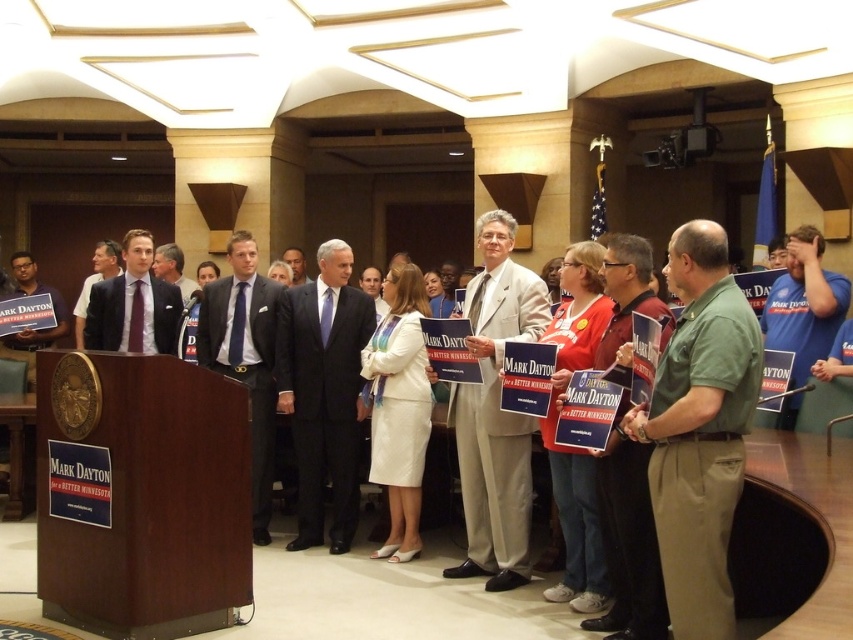
Is blue t-shirt at right below dark blue suit at center?

Correct, blue t-shirt at right is located below dark blue suit at center.

Based on the photo, which is below, blue t-shirt at right or dark blue suit at center?

blue t-shirt at right

Does point (837, 292) lie in front of point (288, 256)?

Yes, point (837, 292) is closer to viewer.

Find the location of a particular element. Image resolution: width=853 pixels, height=640 pixels. blue t-shirt at right is located at coordinates (804, 305).

Who is taller, matte black suit at center or light brown suit at center?

With more height is matte black suit at center.

Which is behind, point (364, 298) or point (164, 273)?

The point (164, 273) is behind.

Is point (294, 346) positioned after point (161, 259)?

No, (294, 346) is closer to viewer.

Find the location of a particular element. The height and width of the screenshot is (640, 853). matte black suit at center is located at coordinates (323, 392).

Consider the image. Is green fabric shirt at center taller than light beige suit at center?

Incorrect, green fabric shirt at center's height is not larger of light beige suit at center's.

Does point (733, 436) come closer to viewer compared to point (463, 416)?

Yes, point (733, 436) is closer to viewer.

Identify the location of green fabric shirt at center. (699, 429).